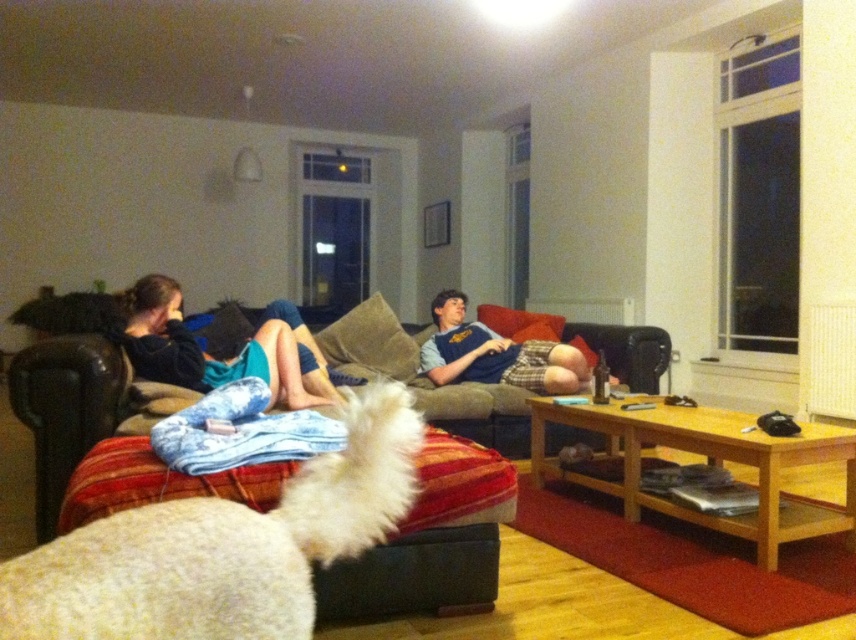
Question: Is blue denim shorts at left wider than blue jersey at center?

Choices:
 (A) no
 (B) yes

Answer: (A)

Question: Which of the following is the closest to the observer?

Choices:
 (A) (70, 593)
 (B) (458, 333)
 (C) (146, 368)

Answer: (A)

Question: Estimate the real-world distances between objects in this image. Which object is farther from the blue jersey at center?

Choices:
 (A) white fluffy dog at lower left
 (B) blue denim shorts at left

Answer: (A)

Question: Is blue denim shorts at left wider than blue jersey at center?

Choices:
 (A) yes
 (B) no

Answer: (B)

Question: From the image, what is the correct spatial relationship of blue denim shorts at left in relation to blue jersey at center?

Choices:
 (A) right
 (B) left

Answer: (B)

Question: Among these points, which one is nearest to the camera?

Choices:
 (A) (266, 346)
 (B) (72, 595)
 (C) (513, 380)

Answer: (B)